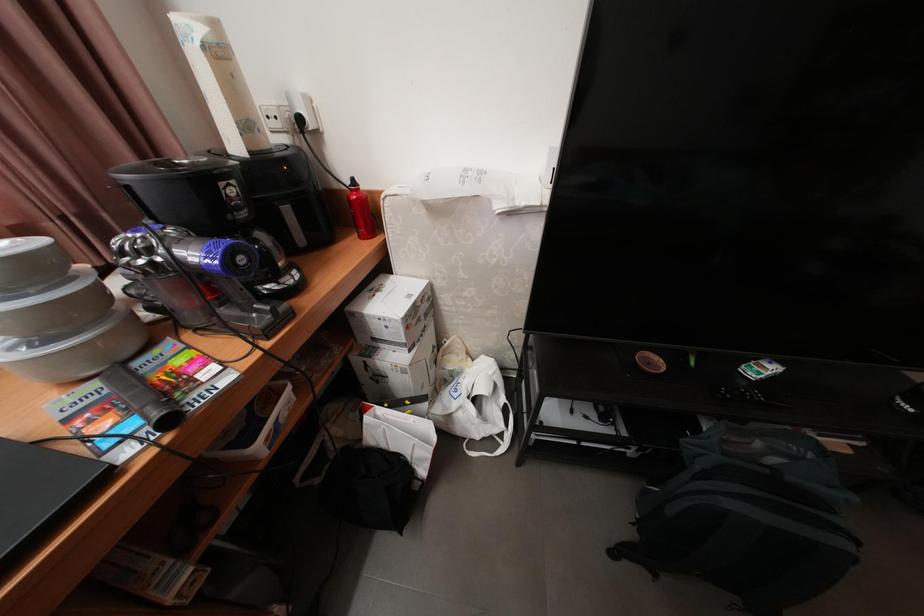
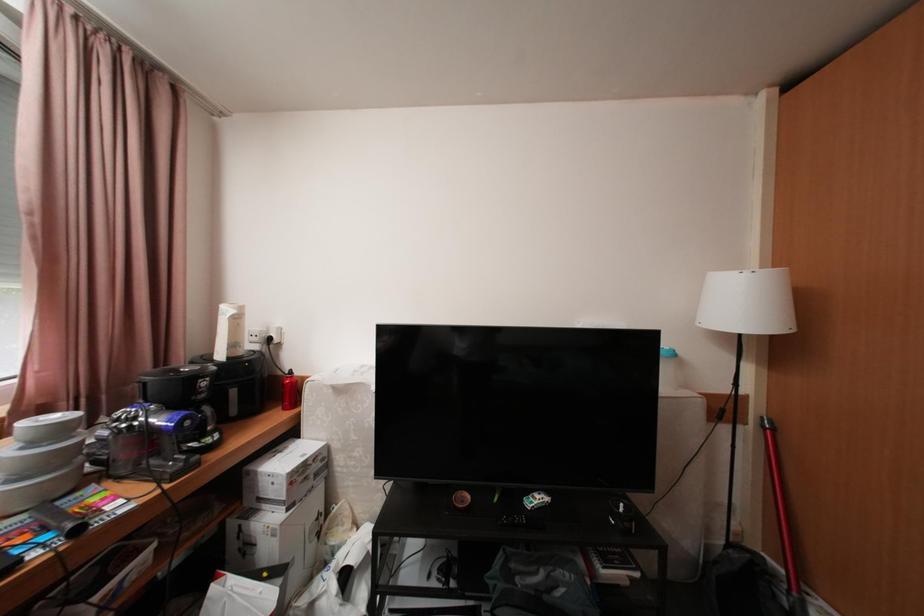
Question: The first image is from the beginning of the video and the second image is from the end. How did the camera likely rotate when shooting the video?

Choices:
 (A) Left
 (B) Right
 (C) Up
 (D) Down

Answer: (C)